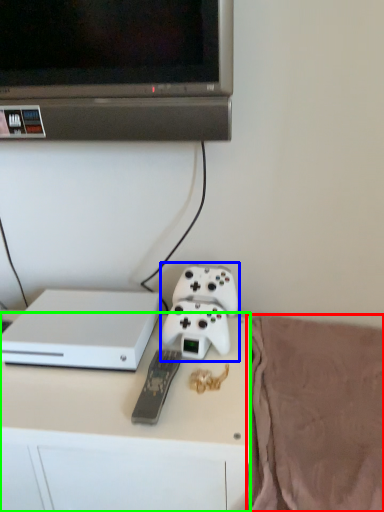
Question: Estimate the real-world distances between objects in this image. Which object is closer to blanket (highlighted by a red box), game controller (highlighted by a blue box) or desk (highlighted by a green box)?

Choices:
 (A) game controller
 (B) desk

Answer: (B)